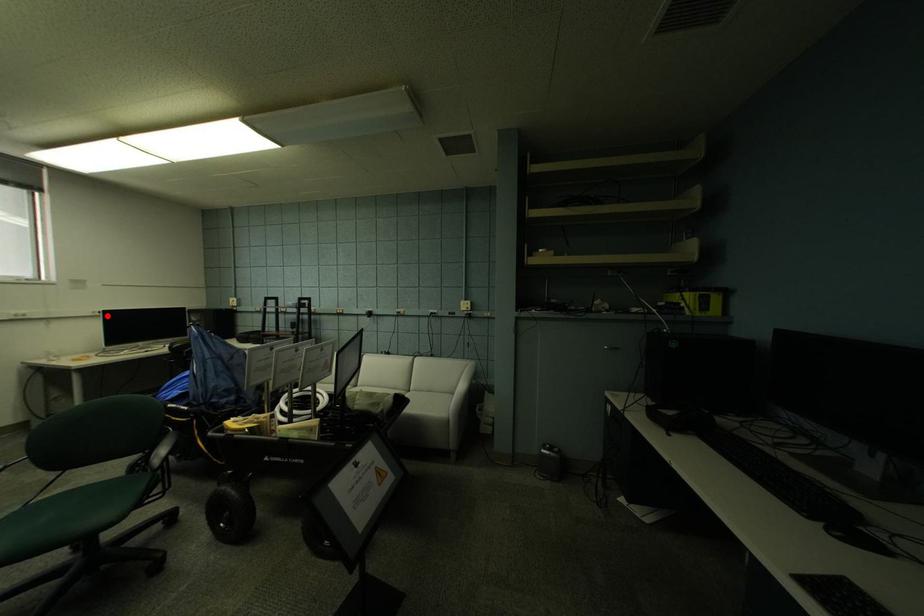
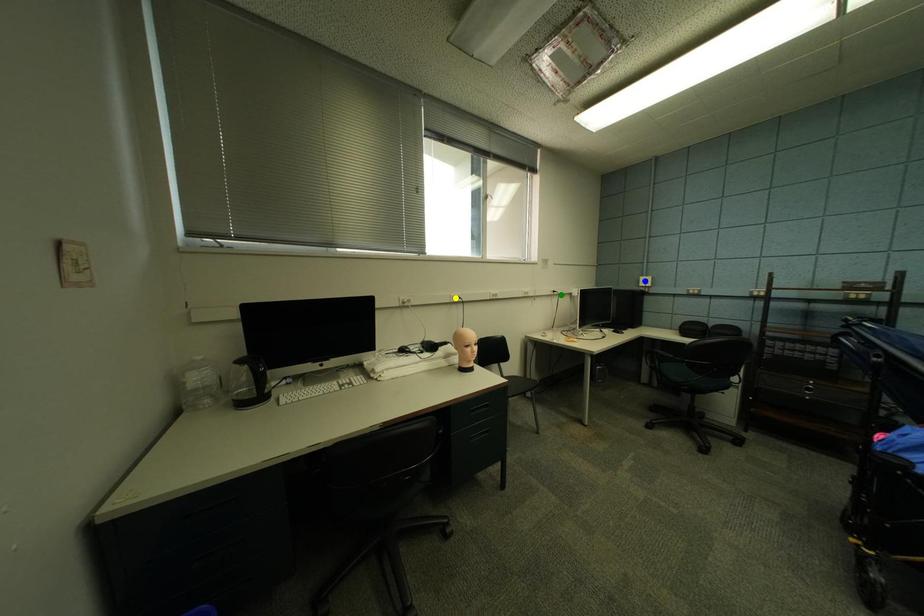
Question: I am providing you with two images of the same scene from different viewpoints. A red point is marked on the first image. You are given multiple points on the second image. Which spot in image 2 lines up with the point in image 1?

Choices:
 (A) green point
 (B) yellow point
 (C) blue point

Answer: (A)